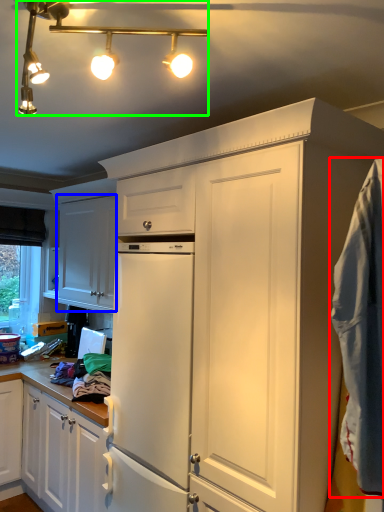
Question: Which is farther away from blanket (highlighted by a red box)? cabinetry (highlighted by a blue box) or light fixture (highlighted by a green box)?

Choices:
 (A) cabinetry
 (B) light fixture

Answer: (A)